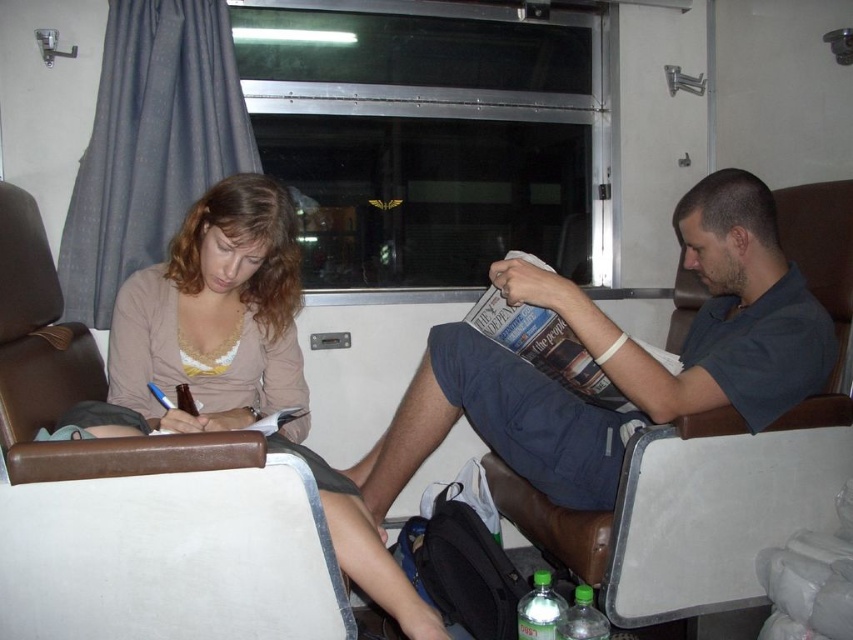
Question: Estimate the real-world distances between objects in this image. Which object is closer to the matte paper magazine at center?

Choices:
 (A) brown leather chair at left
 (B) brown leather chair at center

Answer: (B)

Question: Which of the following is the closest to the observer?

Choices:
 (A) matte paper magazine at center
 (B) brown leather chair at center

Answer: (A)

Question: Among these points, which one is nearest to the camera?

Choices:
 (A) (4, 416)
 (B) (589, 561)
 (C) (556, 317)

Answer: (A)

Question: Is brown leather chair at center bigger than matte paper magazine at center?

Choices:
 (A) yes
 (B) no

Answer: (A)

Question: Does brown leather chair at center have a lesser width compared to matte paper magazine at center?

Choices:
 (A) yes
 (B) no

Answer: (B)

Question: Considering the relative positions of brown leather chair at left and matte paper magazine at center in the image provided, where is brown leather chair at left located with respect to matte paper magazine at center?

Choices:
 (A) above
 (B) below

Answer: (B)